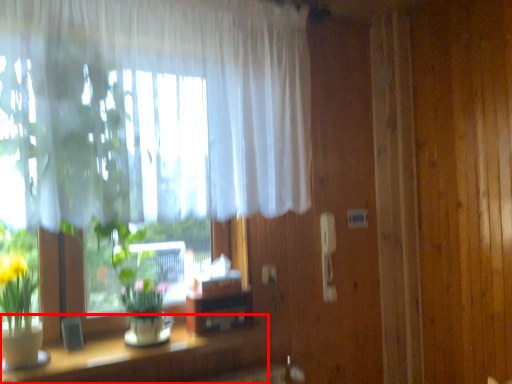
Question: From the image's perspective, considering the relative positions of table (annotated by the red box) and curtain in the image provided, where is table (annotated by the red box) located with respect to the staircase?

Choices:
 (A) above
 (B) below

Answer: (B)